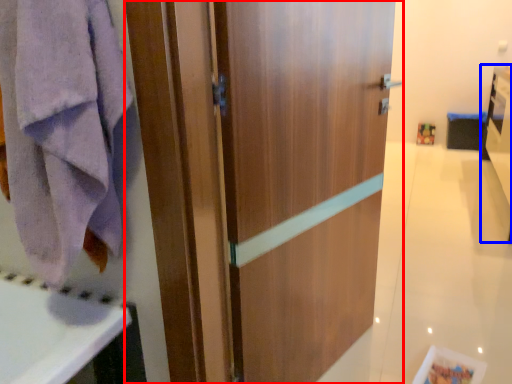
Question: Which of the following is the closest to the observer, door (highlighted by a red box) or vanity (highlighted by a blue box)?

Choices:
 (A) door
 (B) vanity

Answer: (A)